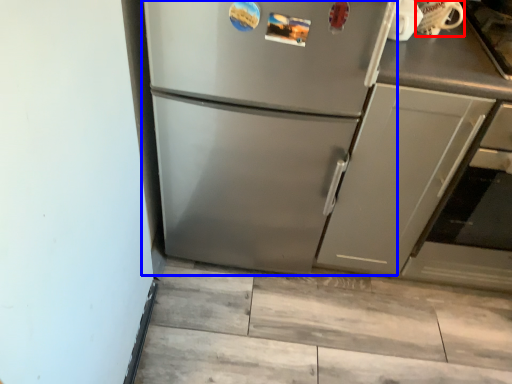
Question: Which of the following is the farthest to the observer, appliance (highlighted by a red box) or refrigerator (highlighted by a blue box)?

Choices:
 (A) appliance
 (B) refrigerator

Answer: (A)